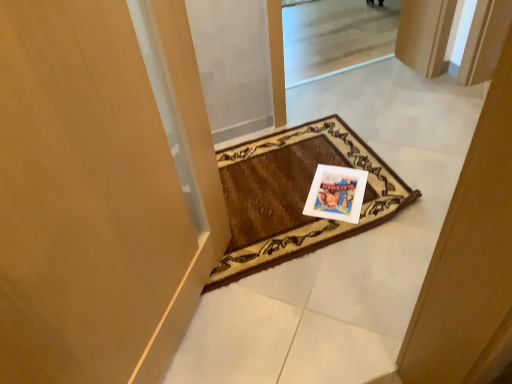
The image size is (512, 384). Describe the element at coordinates (336, 193) in the screenshot. I see `white paper postcard at center` at that location.

Where is `white paper postcard at center`? white paper postcard at center is located at coordinates (336, 193).

What do you see at coordinates (295, 195) in the screenshot?
I see `brown woven mat at center` at bounding box center [295, 195].

Locate an element on the screen. This screenshot has width=512, height=384. brown woven mat at center is located at coordinates (295, 195).

Where is `white paper postcard at center`? white paper postcard at center is located at coordinates (336, 193).

Considering the positions of objects white paper postcard at center and brown woven mat at center in the image provided, who is more to the left, white paper postcard at center or brown woven mat at center?

brown woven mat at center.

In the image, is white paper postcard at center positioned in front of or behind brown woven mat at center?

white paper postcard at center is behind brown woven mat at center.

Between point (344, 211) and point (417, 193), which one is positioned in front?

The point (344, 211) is closer.

From the image's perspective, would you say white paper postcard at center is shown under brown woven mat at center?

Yes, from the image's perspective, white paper postcard at center is below brown woven mat at center.

From a real-world perspective, is white paper postcard at center physically located above or below brown woven mat at center?

Clearly, from a real-world perspective, white paper postcard at center is below brown woven mat at center.

Considering the relative sizes of white paper postcard at center and brown woven mat at center in the image provided, is white paper postcard at center thinner than brown woven mat at center?

Indeed, white paper postcard at center has a lesser width compared to brown woven mat at center.

Who is taller, white paper postcard at center or brown woven mat at center?

Standing taller between the two is brown woven mat at center.

Does white paper postcard at center have a larger size compared to brown woven mat at center?

No, white paper postcard at center is not bigger than brown woven mat at center.

Is brown woven mat at center located within white paper postcard at center?

That's incorrect, brown woven mat at center is not inside white paper postcard at center.

Is white paper postcard at center next to brown woven mat at center and touching it?

No, white paper postcard at center is not beside brown woven mat at center.

Is white paper postcard at center positioned with its back to brown woven mat at center?

Yes.

At what (x,y) coordinates should I click in order to perform the action: click on mat above the white paper postcard at center (from the image's perspective). Please return your answer as a coordinate pair (x, y). This screenshot has height=384, width=512. Looking at the image, I should click on (295, 195).

Would you say brown woven mat at center is to the left or to the right of white paper postcard at center in the picture?

Based on their positions, brown woven mat at center is located to the left of white paper postcard at center.

Relative to white paper postcard at center, is brown woven mat at center in front or behind?

In the image, brown woven mat at center appears in front of white paper postcard at center.

Does point (274, 257) lie behind point (335, 174)?

No, it is not.

From the image's perspective, is brown woven mat at center under white paper postcard at center?

No, from the image's perspective, brown woven mat at center is not below white paper postcard at center.

From a real-world perspective, is brown woven mat at center on white paper postcard at center?

Correct, in the physical world, brown woven mat at center is higher than white paper postcard at center.

Considering the sizes of objects brown woven mat at center and white paper postcard at center in the image provided, who is thinner, brown woven mat at center or white paper postcard at center?

With smaller width is white paper postcard at center.

Considering the sizes of objects brown woven mat at center and white paper postcard at center in the image provided, who is taller, brown woven mat at center or white paper postcard at center?

With more height is brown woven mat at center.

Does brown woven mat at center have a smaller size compared to white paper postcard at center?

No, brown woven mat at center is not smaller than white paper postcard at center.

Is brown woven mat at center positioned beyond the bounds of white paper postcard at center?

That's correct, brown woven mat at center is outside of white paper postcard at center.

Is brown woven mat at center beside white paper postcard at center?

No, brown woven mat at center is not with white paper postcard at center.

Is brown woven mat at center looking in the opposite direction of white paper postcard at center?

No, brown woven mat at center's orientation is not away from white paper postcard at center.

What's the angular difference between brown woven mat at center and white paper postcard at center's facing directions?

The facing directions of brown woven mat at center and white paper postcard at center are 39.8 degrees apart.

Identify the location of postcard located below the brown woven mat at center (from the image's perspective). The height and width of the screenshot is (384, 512). (336, 193).

I want to click on mat located above the white paper postcard at center (from the image's perspective), so click(295, 195).

Identify the location of postcard beneath the brown woven mat at center (from a real-world perspective). (336, 193).